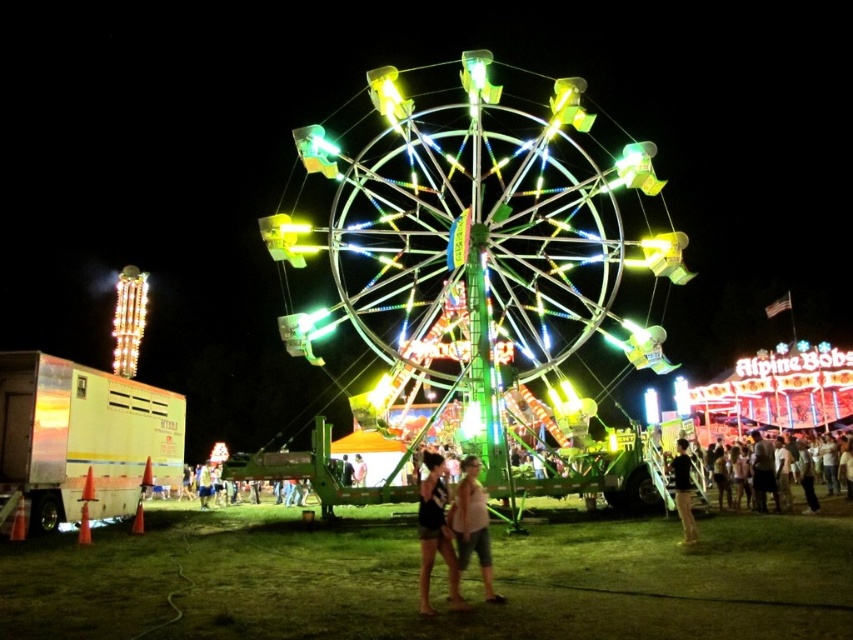
You are standing at the point marked by the coordinates point (473, 525). Looking around, you see the matte pink shirt at center. Which direction should you walk to reach the Ferris wheel?

The point (473, 525) is located at the matte pink shirt at center. Since the Ferris wheel is the focal point in the scene and is positioned in the center, you should walk towards the center to reach it.

You are standing at the camera position and want to take a photo of the multicolored metallic ferris wheel at center. The camera has a maximum zoom range of 100 meters. Can you capture the entire ferris wheel in your photo without moving closer?

The multicolored metallic ferris wheel at center and camera are 108.09 meters apart. Since the camera can only zoom up to 100 meters, you cannot capture the entire ferris wheel in your photo without moving closer.

You are standing at the entrance of the fairground and see the multicolored metallic ferris wheel at center and the dark gray shirt at lower right. Which object is closer to you?

The dark gray shirt at lower right is closer to you because it is positioned under the multicolored metallic ferris wheel at center, indicating it is in the foreground.